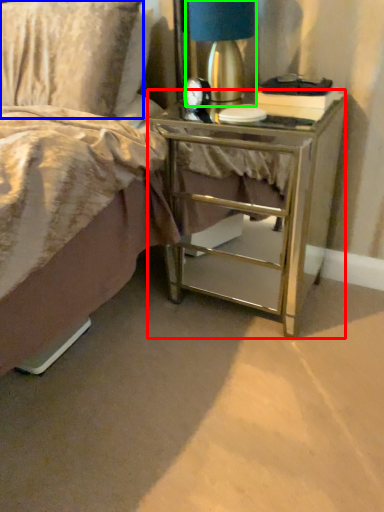
Question: Which object is the closest to the nightstand (highlighted by a red box)? Choose among these: pillow (highlighted by a blue box) or bedside lamp (highlighted by a green box).

Choices:
 (A) pillow
 (B) bedside lamp

Answer: (B)